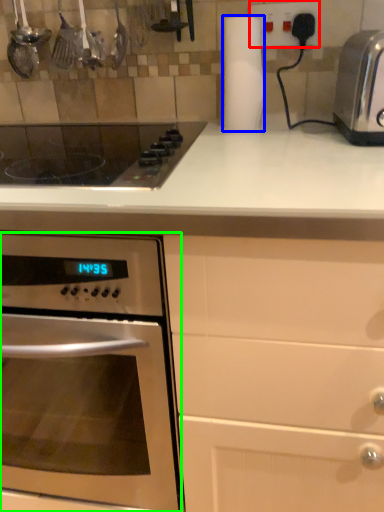
Question: Based on their relative distances, which object is farther from electric outlet (highlighted by a red box)? Choose from paper towel (highlighted by a blue box) and oven (highlighted by a green box).

Choices:
 (A) paper towel
 (B) oven

Answer: (B)